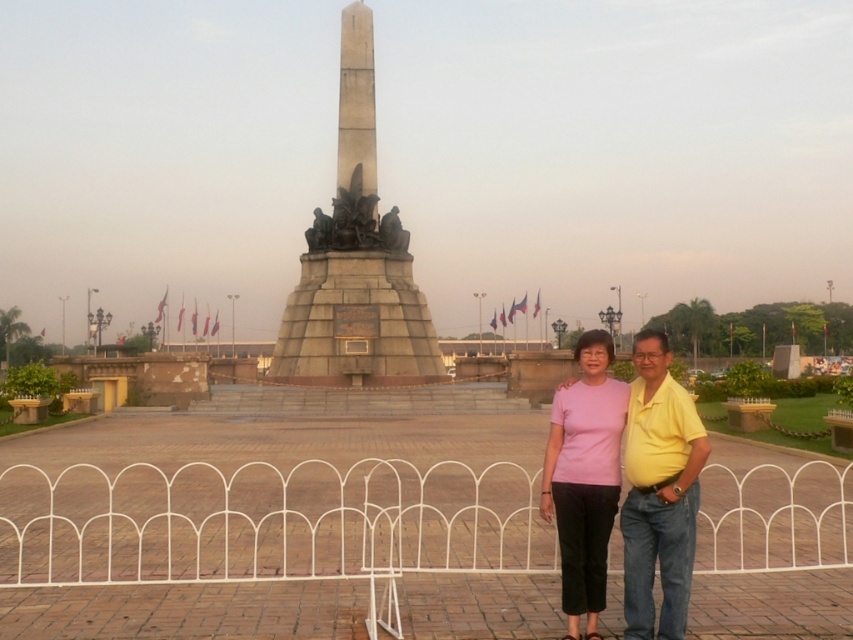
You are taking a photo of the gray stone monument at center and the pink matte shirt at center. Which object should you focus on first if you want to capture both in the same frame without moving the camera?

The gray stone monument at center is positioned on the left side of the pink matte shirt at center, so you should focus on the pink matte shirt at center first to ensure both are in the frame.

You are standing at the point marked as point [341,304] in the image. You want to throw a ball to a friend who is standing exactly where the viewer is positioned. If the maximum distance you can throw is 80 meters, will you be able to reach them?

The distance between point [341,304] and the viewer is 83.16 meters. Since your maximum throw is 80 meters, you cannot reach them.

You are standing at the center of the public square and want to take a photo of the gray stone monument at center. Since the monument is at the center, you might think it is directly in front of you. However, according to the coordinates given, is the monument actually positioned exactly at the center of the square? Please explain based on the coordinates provided.

The gray stone monument at center is located at coordinates point (357, 260), which are not exactly at the center point of the square. Therefore, the monument is slightly offset from the true center.